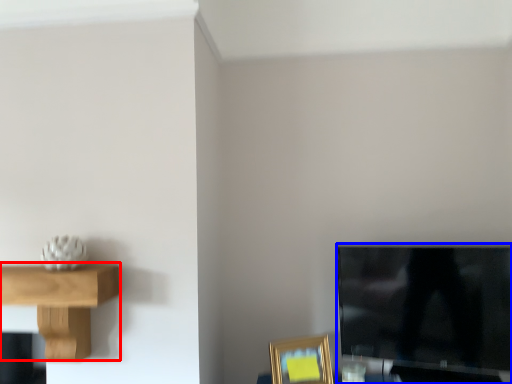
Question: Which object is closer to the camera taking this photo, shelf (highlighted by a red box) or television (highlighted by a blue box)?

Choices:
 (A) shelf
 (B) television

Answer: (A)